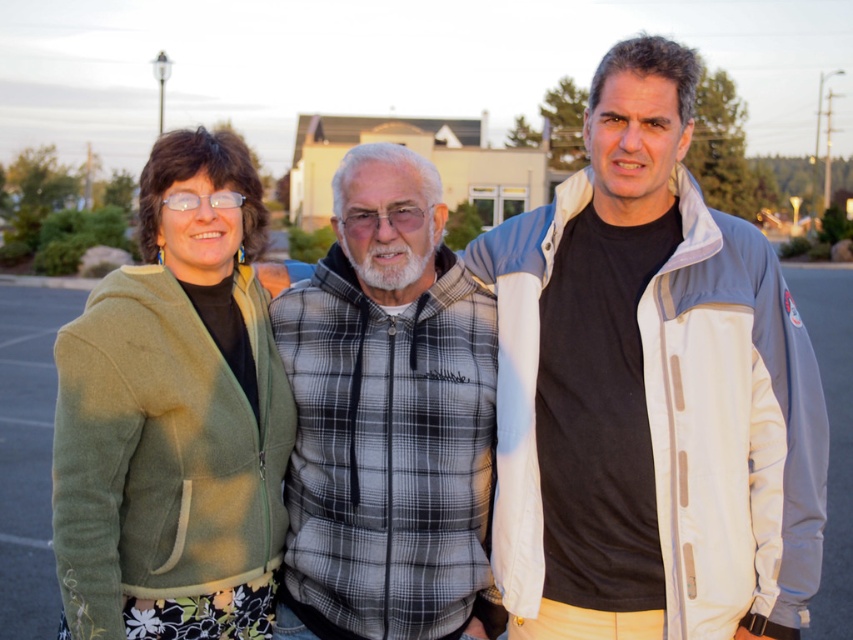
You are a photographer trying to capture a photo of the two people in the scene. You want to ensure that the green fleece jacket at left and the plaid fabric vest at center are both visible in the frame. Based on their positions, which direction should you move your camera to include both subjects?

The green fleece jacket at left is to the left of the plaid fabric vest at center. To include both in the frame, you should move your camera slightly to the right to ensure both the green fleece jacket at left and the plaid fabric vest at center are visible.